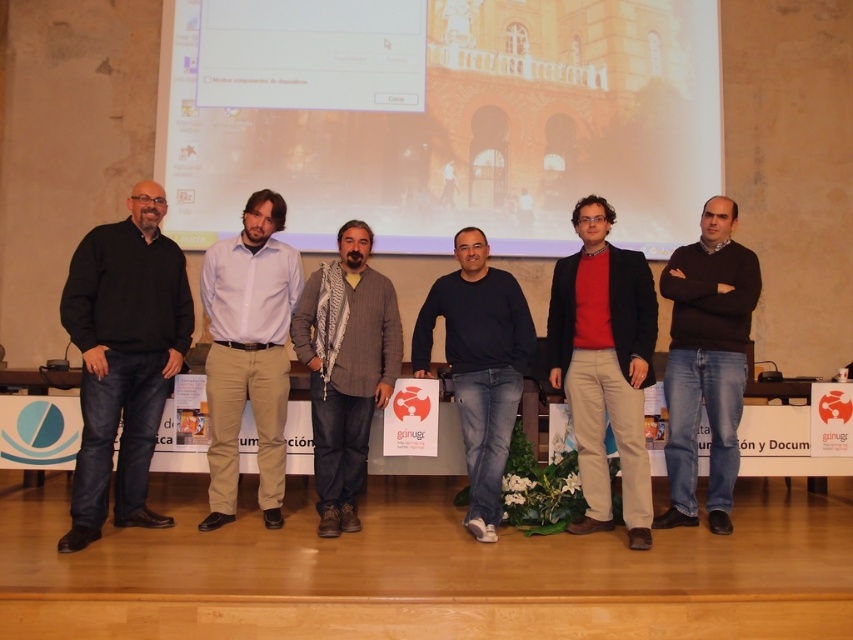
You are a photographer at the back of the stage. You want to take a photo of the red matte sweater at center and the brown sweater at center. Which one will appear closer to you in the photo?

The red matte sweater at center will appear closer to you in the photo because it is in front of the brown sweater at center.

You are organizing a photoshoot and need to know which clothing item is narrower between the light blue shirt at center and the gray wool scarf at center. Based on the scene description, which one is narrower?

The light blue shirt at center is narrower than the gray wool scarf at center, as its width is less than the scarf.

You are a photographer at the event and need to arrange the subjects so that the light blue shirt at center is positioned to the right of the gray wool scarf at center for a better composition. Based on the current arrangement, is this adjustment needed?

The light blue shirt at center is currently to the left of the gray wool scarf at center, so to achieve the desired composition, the photographer needs to move the light blue shirt at center to the right side of the gray wool scarf at center.